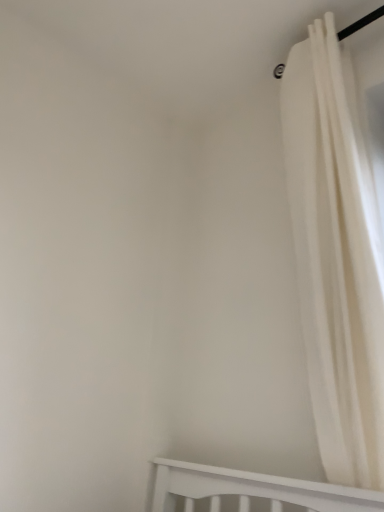
What do you see at coordinates (336, 257) in the screenshot? I see `white sheer curtain at upper right` at bounding box center [336, 257].

You are a GUI agent. You are given a task and a screenshot of the screen. Output one action in this format:
    pyautogui.click(x=<x>, y=<y>)
    Task: Click on the white sheer curtain at upper right
    
    Given the screenshot: What is the action you would take?
    pyautogui.click(x=336, y=257)

Image resolution: width=384 pixels, height=512 pixels. I want to click on white sheer curtain at upper right, so click(x=336, y=257).